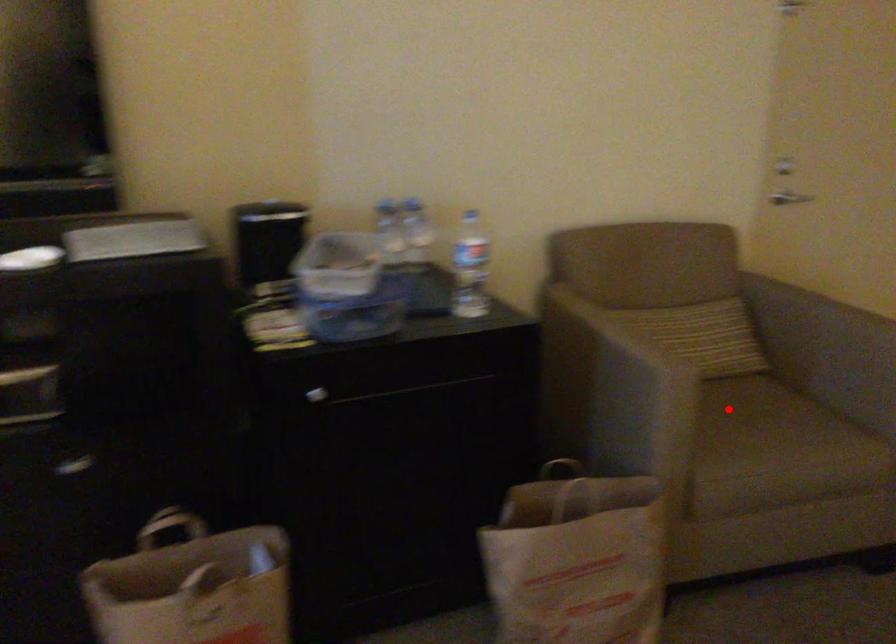
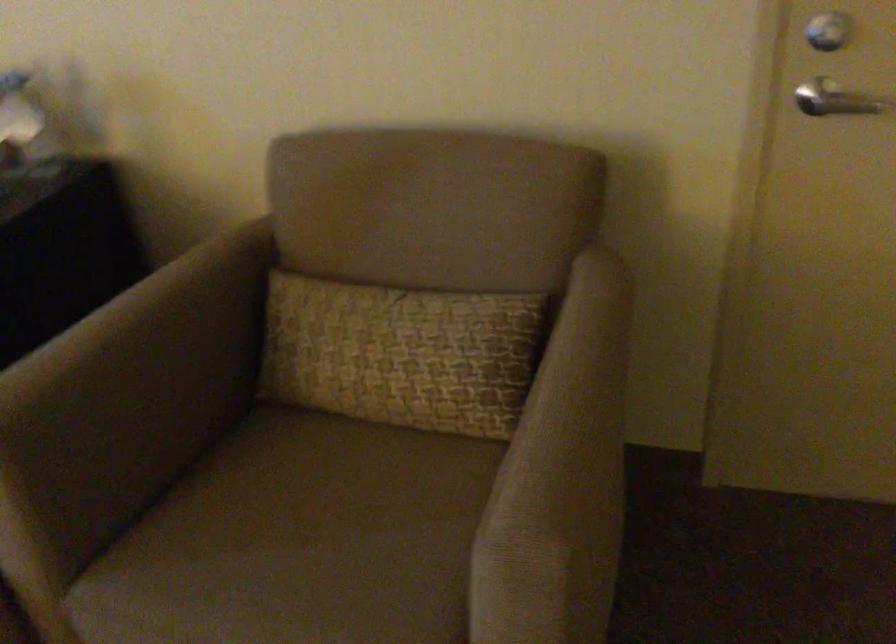
Question: A red point is marked in image1. In image2, is the corresponding 3D point closer to the camera or farther? Reply with the corresponding letter.

Choices:
 (A) The corresponding 3D point is closer.
 (B) The corresponding 3D point is farther.

Answer: (A)